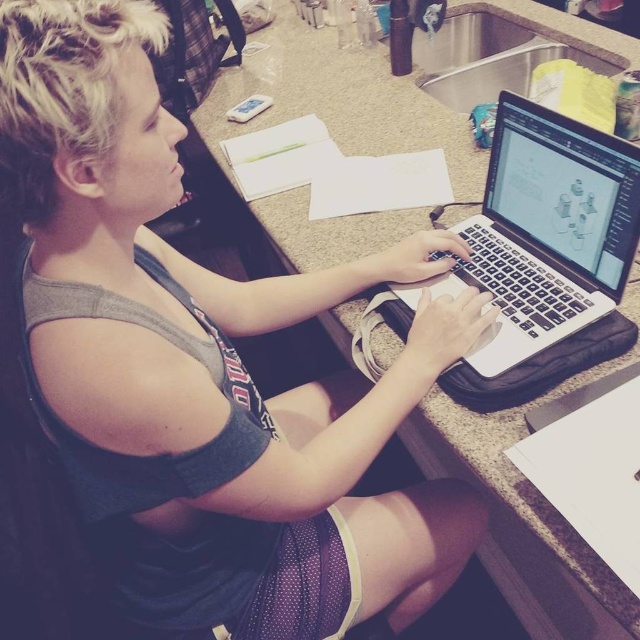
Question: Which point appears closest to the camera in this image?

Choices:
 (A) (592, 220)
 (B) (272, 269)

Answer: (A)

Question: Does granite gray counter top at center appear on the left side of satin black laptop at center?

Choices:
 (A) yes
 (B) no

Answer: (A)

Question: Which of the following is the closest to the observer?

Choices:
 (A) granite gray counter top at center
 (B) satin black laptop at center

Answer: (A)

Question: Is granite gray counter top at center thinner than satin black laptop at center?

Choices:
 (A) no
 (B) yes

Answer: (A)

Question: Which of the following is the farthest from the observer?

Choices:
 (A) (426, 452)
 (B) (588, 225)

Answer: (A)

Question: Can you confirm if granite gray counter top at center is positioned to the left of satin black laptop at center?

Choices:
 (A) no
 (B) yes

Answer: (B)